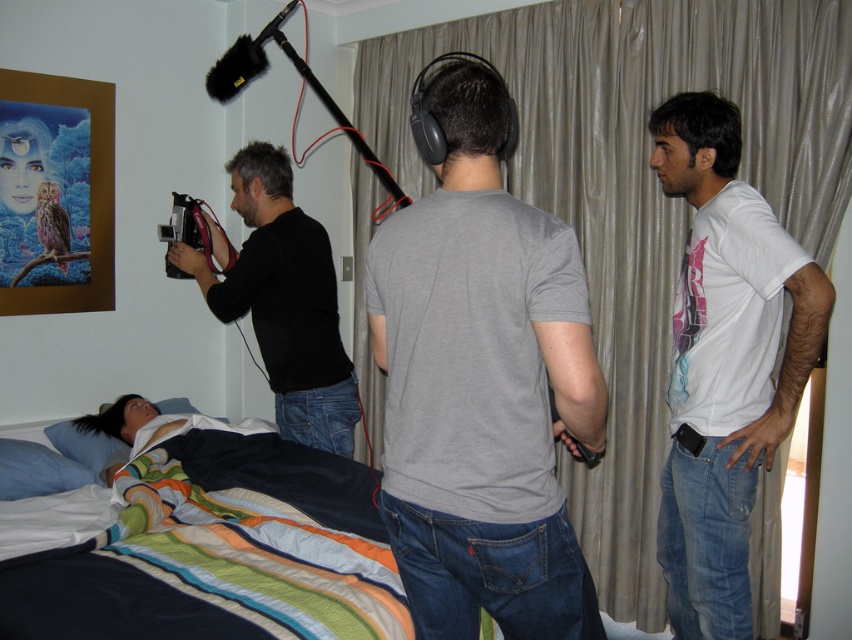
Can you confirm if striped cotton bed at center is positioned to the right of white matte t-shirt at right?

Incorrect, striped cotton bed at center is not on the right side of white matte t-shirt at right.

Image resolution: width=852 pixels, height=640 pixels. Describe the element at coordinates (204, 545) in the screenshot. I see `striped cotton bed at center` at that location.

Where is `striped cotton bed at center`? The width and height of the screenshot is (852, 640). striped cotton bed at center is located at coordinates (204, 545).

Can you confirm if white matte t-shirt at right is bigger than black plastic video camera at left?

Yes, white matte t-shirt at right is bigger than black plastic video camera at left.

Who is more forward, (694, 499) or (182, 212)?

Positioned in front is point (694, 499).

The width and height of the screenshot is (852, 640). What are the coordinates of `white matte t-shirt at right` in the screenshot? It's located at (724, 364).

Can you confirm if black matte camera at center is positioned below black plastic video camera at left?

Yes.

In the scene shown: Is black matte camera at center closer to camera compared to black plastic video camera at left?

Yes, black matte camera at center is closer to the viewer.

Is point (331, 288) positioned in front of point (206, 252)?

Yes, it is in front of point (206, 252).

Identify the location of black matte camera at center. The image size is (852, 640). (281, 300).